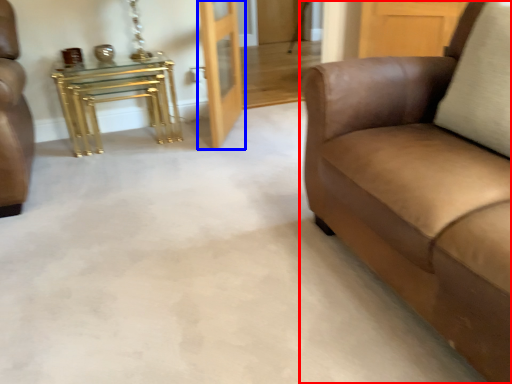
Question: Which point is further to the camera, studio couch (highlighted by a red box) or door (highlighted by a blue box)?

Choices:
 (A) studio couch
 (B) door

Answer: (B)